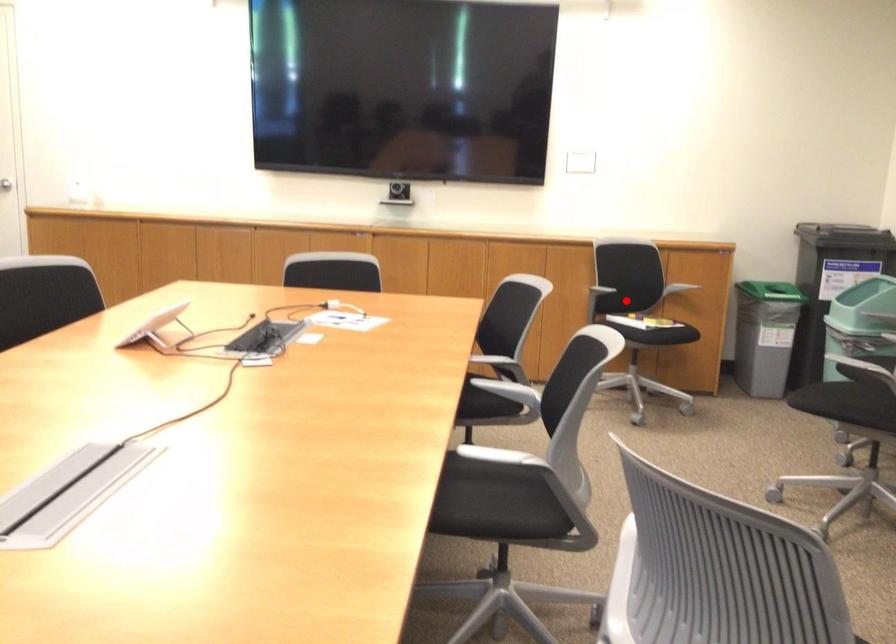
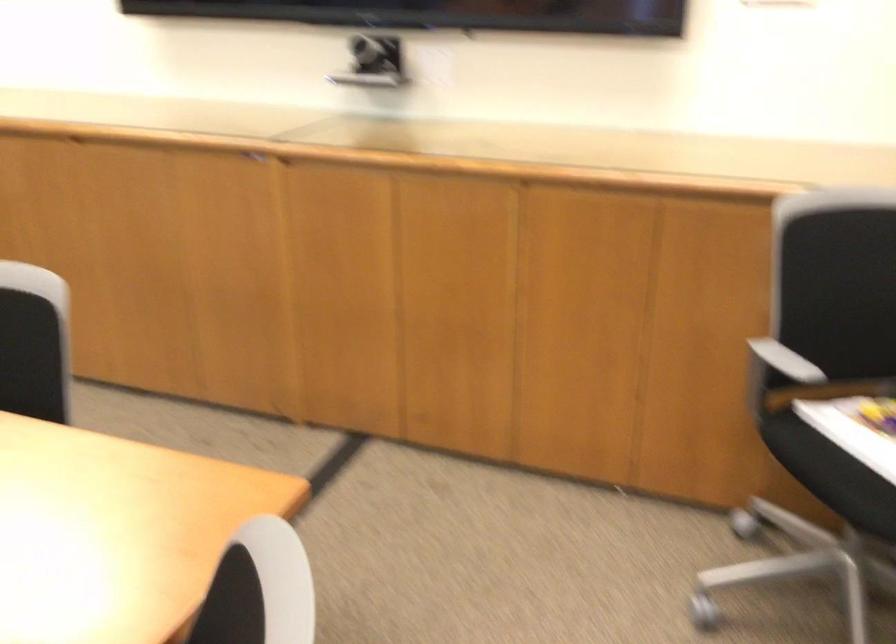
In the second image, find the point that corresponds to the highlighted location in the first image.

(857, 428)